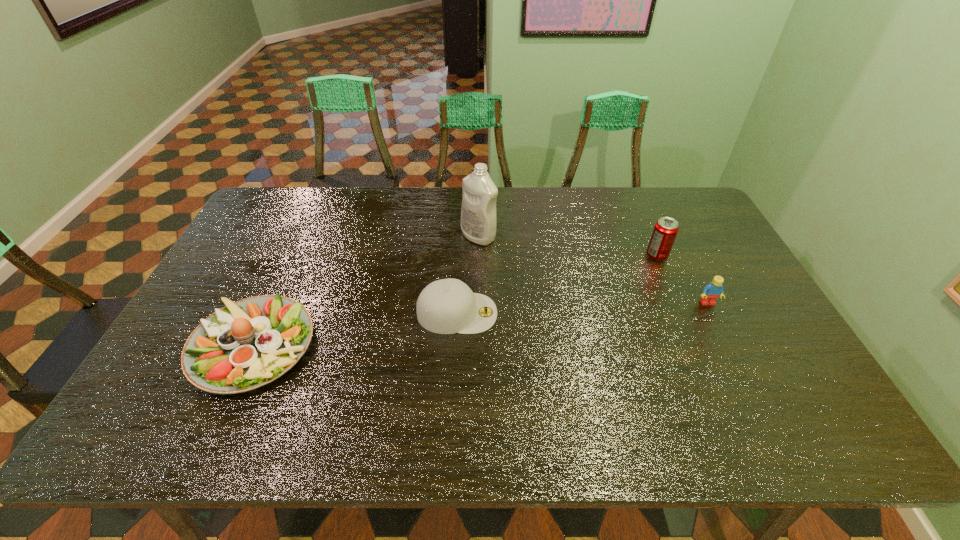
At what (x,y) coordinates should I click in order to perform the action: click on the farthest object. Please return your answer as a coordinate pair (x, y). The width and height of the screenshot is (960, 540). Looking at the image, I should click on (478, 211).

What are the coordinates of `detergent` in the screenshot? It's located at (478, 211).

Where is `the fourth nearest object`? The width and height of the screenshot is (960, 540). the fourth nearest object is located at coordinates pos(665,230).

At what (x,y) coordinates should I click in order to perform the action: click on the second object from right to left. Please return your answer as a coordinate pair (x, y). Looking at the image, I should click on tap(665, 230).

Identify the location of Lego. The width and height of the screenshot is (960, 540). (714, 289).

Image resolution: width=960 pixels, height=540 pixels. I want to click on the leftmost object, so tap(249, 343).

Locate an element on the screen. This screenshot has height=540, width=960. cap is located at coordinates (447, 306).

The height and width of the screenshot is (540, 960). Identify the location of free space located on the left of the tallest object. (358, 237).

Locate an element on the screen. The width and height of the screenshot is (960, 540). free spot located 0.390m on the left of the second object from right to left is located at coordinates (522, 255).

At what (x,y) coordinates should I click in order to perform the action: click on free space located on the face of the rightmost object. Please return your answer as a coordinate pair (x, y). This screenshot has width=960, height=540. Looking at the image, I should click on (734, 357).